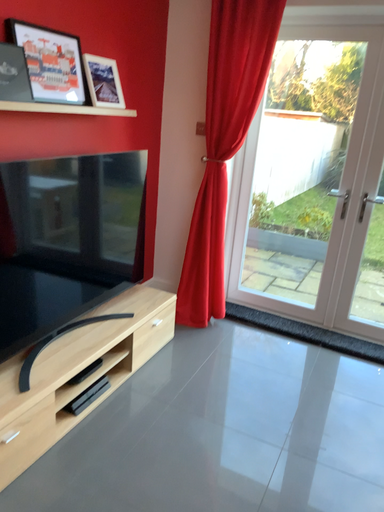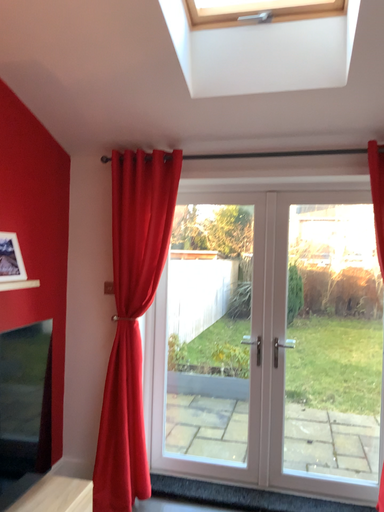
Question: How did the camera likely rotate when shooting the video?

Choices:
 (A) rotated right
 (B) rotated left

Answer: (A)